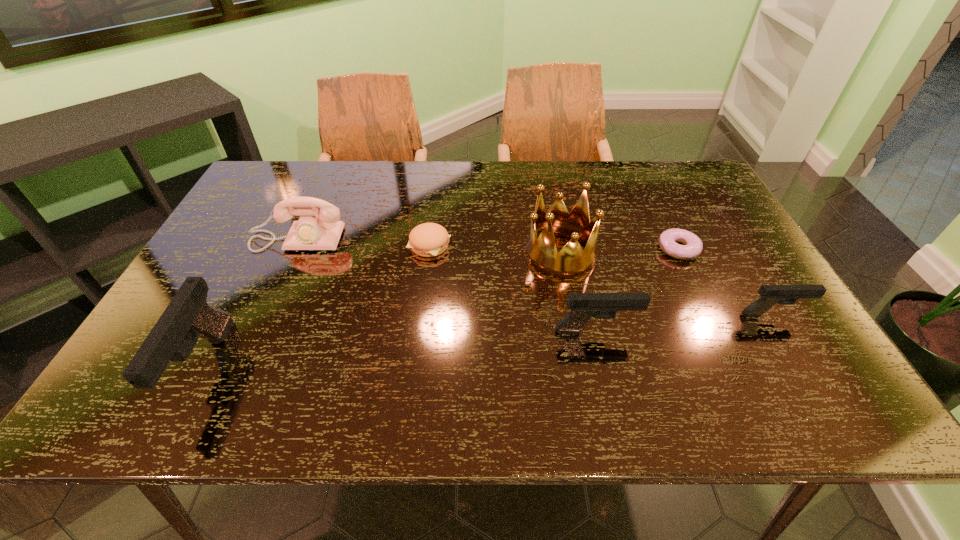
Please point a space for a new pistol to maintain equal intervals. Please provide its 2D coordinates. Your answer should be formatted as a tuple, i.e. [(x, y)], where the tuple contains the x and y coordinates of a point satisfying the conditions above.

[(407, 348)]